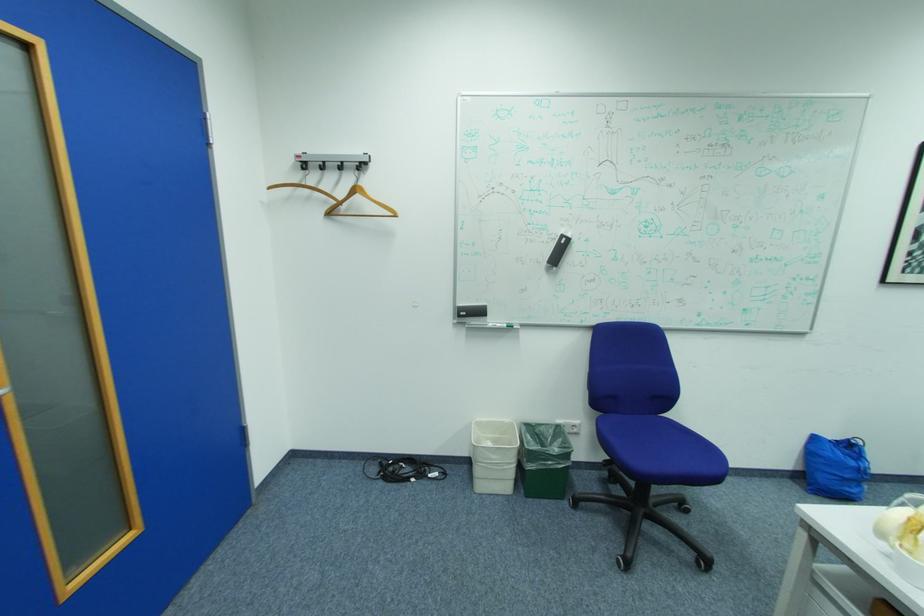
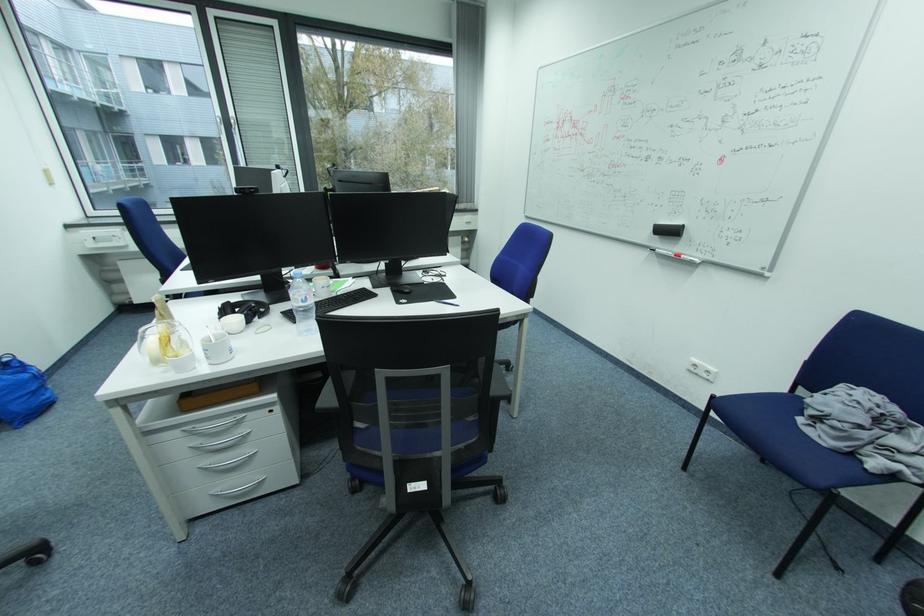
Where in the second image is the point corresponding to point (713, 562) from the first image?

(45, 554)